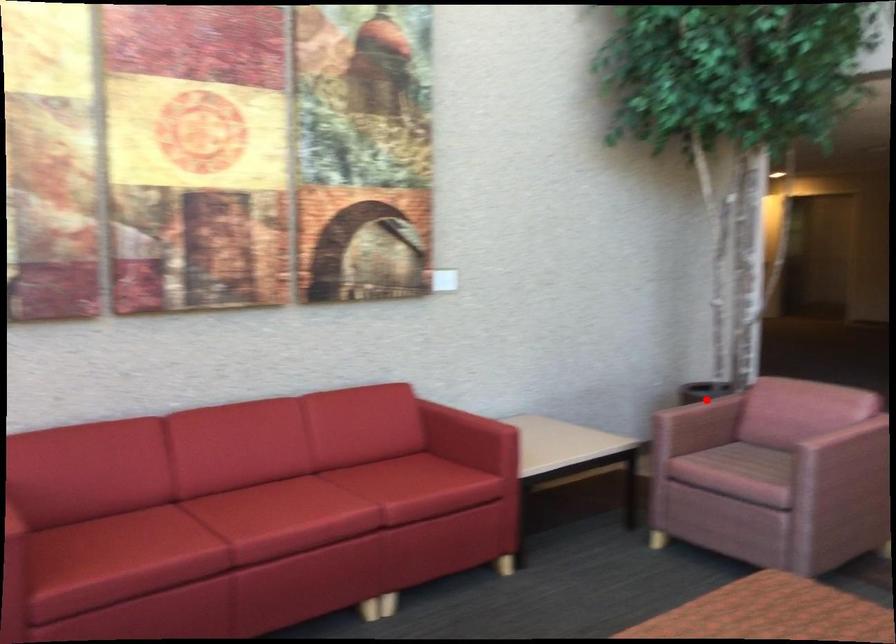
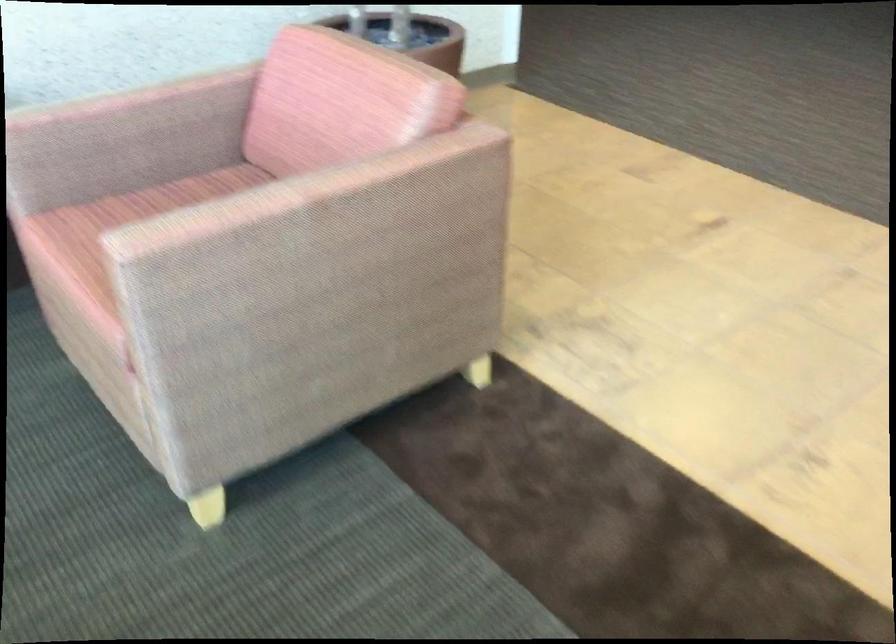
Locate, in the second image, the point that corresponds to the highlighted location in the first image.

(121, 98)